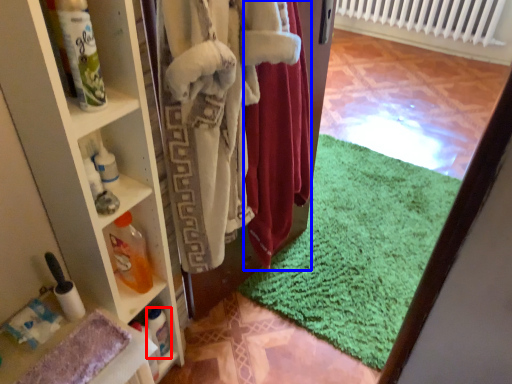
Question: Which of the following is the farthest to the observer, bottle (highlighted by a red box) or clothing (highlighted by a blue box)?

Choices:
 (A) bottle
 (B) clothing

Answer: (A)